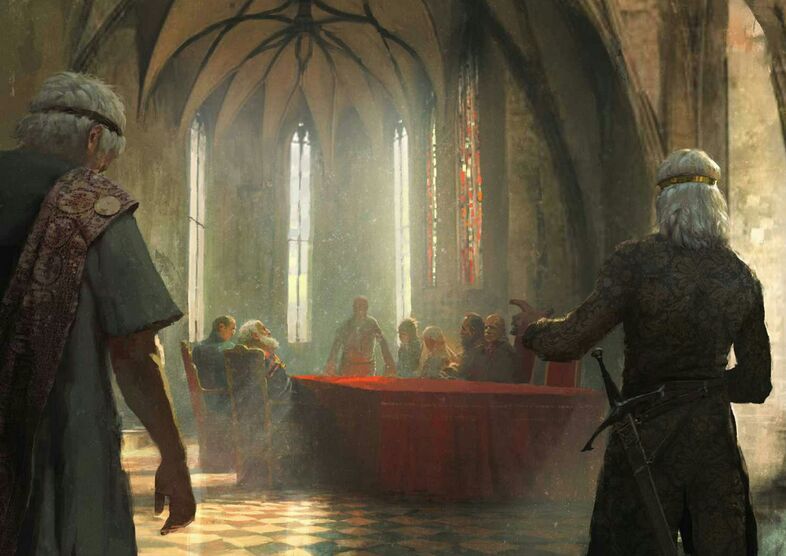
The width and height of the screenshot is (786, 556). I want to click on wall, so click(x=746, y=158), click(x=522, y=186), click(x=68, y=53).